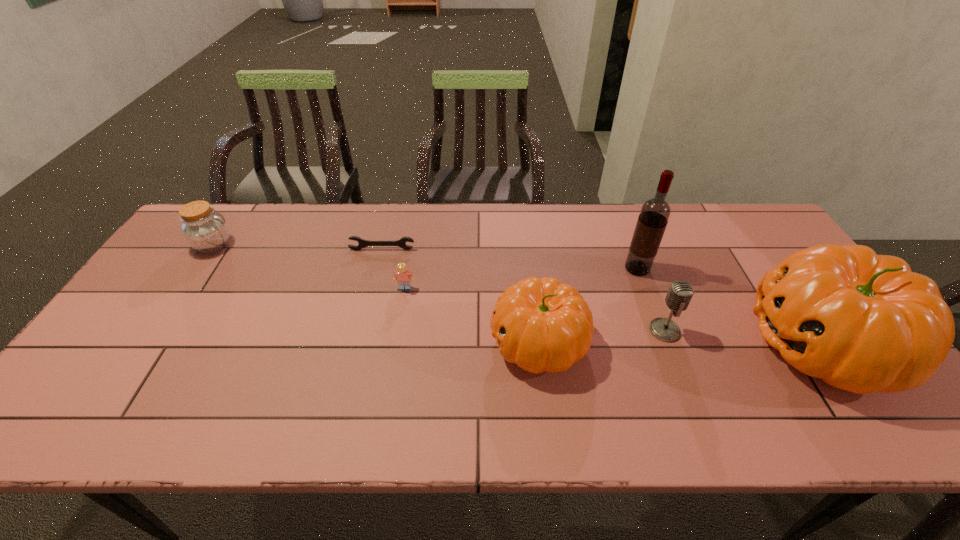
Find the location of a particular element. free spot between the second tallest object and the left pumpkin is located at coordinates (681, 343).

The height and width of the screenshot is (540, 960). What are the coordinates of `vacant space in between the tallest object and the Lego` in the screenshot? It's located at (521, 279).

Select which object appears as the closest to the rightmost object. Please provide its 2D coordinates. Your answer should be formatted as a tuple, i.e. [(x, y)], where the tuple contains the x and y coordinates of a point satisfying the conditions above.

[(680, 293)]

At what (x,y) coordinates should I click in order to perform the action: click on object that can be found as the fourth closest to the fifth nearest object. Please return your answer as a coordinate pair (x, y). The height and width of the screenshot is (540, 960). Looking at the image, I should click on (402, 276).